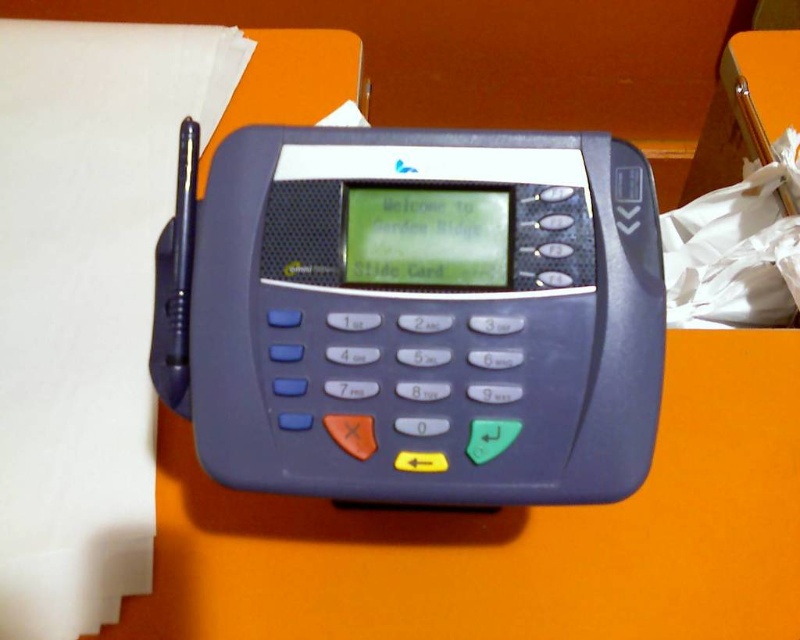
Is matte plastic card reader at center smaller than white paper at left?

Yes, matte plastic card reader at center is smaller than white paper at left.

Is matte plastic card reader at center behind white paper at left?

No, matte plastic card reader at center is in front of white paper at left.

Between point (524, 410) and point (88, 54), which one is positioned behind?

The point (88, 54) is more distant.

I want to click on matte plastic card reader at center, so click(x=420, y=316).

Between orange matte table at center and white paper at left, which one is positioned lower?

orange matte table at center is lower down.

Does orange matte table at center appear under white paper at left?

Yes.

Locate an element on the screen. This screenshot has width=800, height=640. orange matte table at center is located at coordinates (512, 536).

Image resolution: width=800 pixels, height=640 pixels. What are the coordinates of `orange matte table at center` in the screenshot? It's located at (512, 536).

Between point (450, 316) and point (438, 627), which one is positioned behind?

Point (438, 627)

Measure the distance between point (341, 225) and camera.

21.58 inches

Where is `matte plastic card reader at center`? The height and width of the screenshot is (640, 800). matte plastic card reader at center is located at coordinates (420, 316).